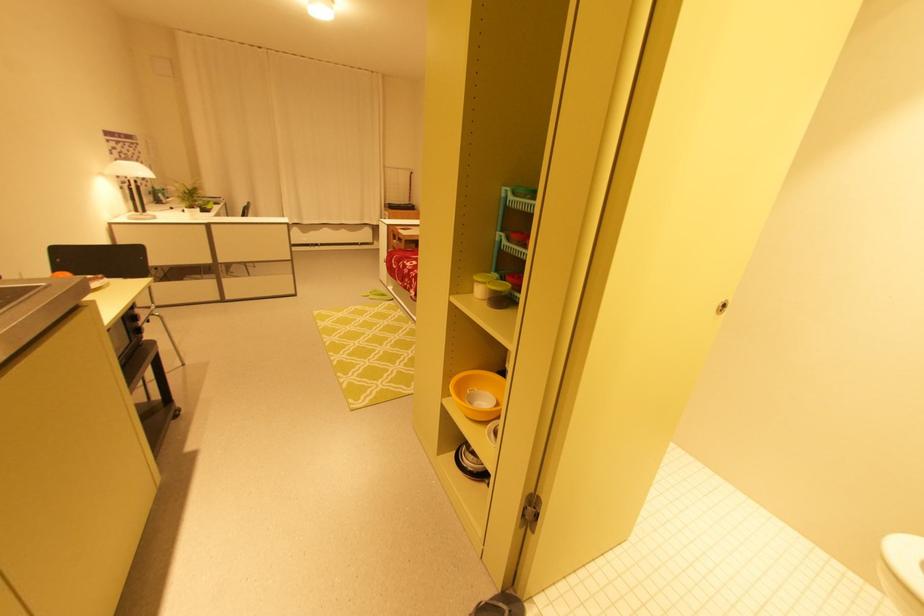
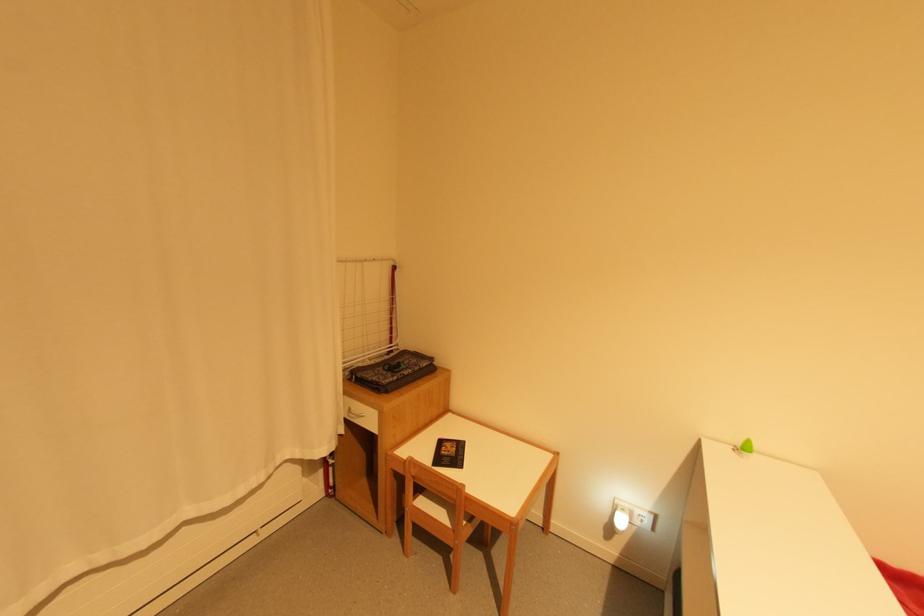
Find the pixel in the second image that matches [410,207] in the first image.

(421, 369)